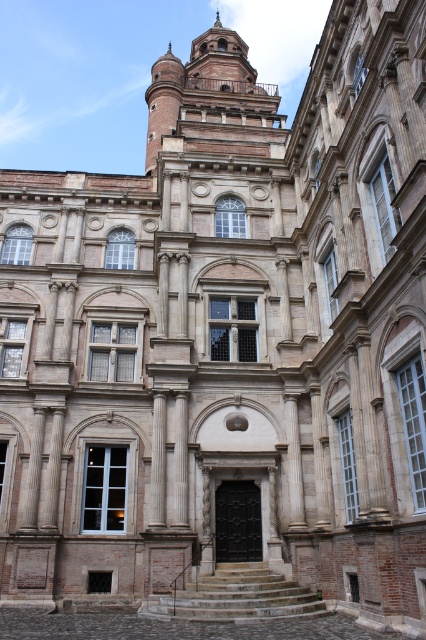
Question: Can you confirm if brown stone tower at upper center is positioned to the left of matte white clock at upper center?

Choices:
 (A) no
 (B) yes

Answer: (B)

Question: Can you confirm if brown stone tower at upper center is thinner than matte white clock at upper center?

Choices:
 (A) no
 (B) yes

Answer: (A)

Question: Among these objects, which one is nearest to the camera?

Choices:
 (A) matte white clock at upper center
 (B) brown stone tower at upper center

Answer: (A)

Question: Among these objects, which one is nearest to the camera?

Choices:
 (A) brown stone tower at upper center
 (B) matte white clock at upper center

Answer: (B)

Question: Does brown stone tower at upper center appear over matte white clock at upper center?

Choices:
 (A) no
 (B) yes

Answer: (B)